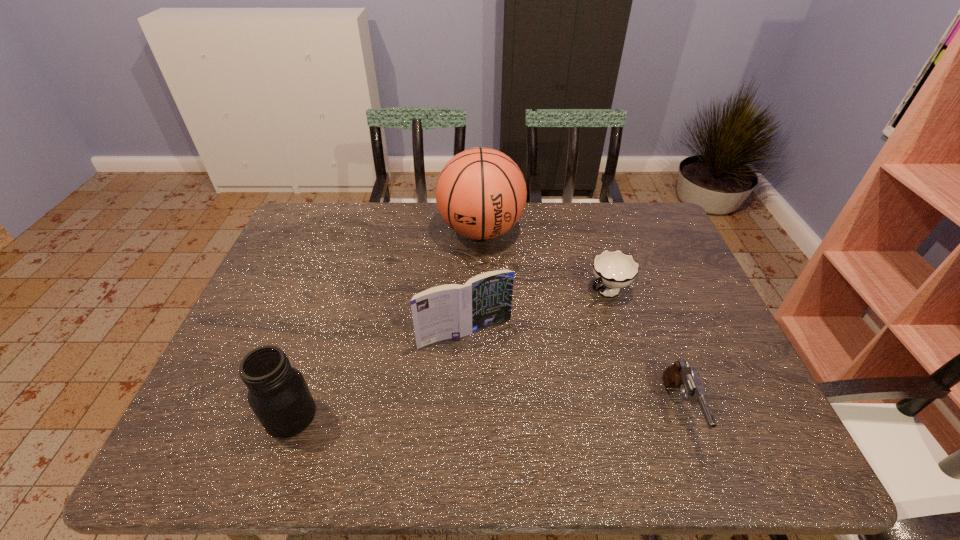
I want to click on object that is at the left edge, so click(x=278, y=394).

Identify the location of object present at the near left corner. pos(278,394).

Where is `vacant space at the far edge of the desktop`? The image size is (960, 540). vacant space at the far edge of the desktop is located at coordinates (516, 237).

Find the location of a particular element. blank area at the near edge is located at coordinates (656, 409).

Identify the location of blank space at the left edge of the desktop. The image size is (960, 540). (307, 256).

In the image, there is a desktop. Where is `free space at the right edge`? The width and height of the screenshot is (960, 540). free space at the right edge is located at coordinates (674, 310).

What are the coordinates of `vacant space at the far left corner` in the screenshot? It's located at (321, 240).

I want to click on vacant space at the far right corner, so click(669, 243).

Identify the location of free space between the fourth tallest object and the second farthest object. This screenshot has height=540, width=960. (643, 350).

In order to click on unoccupied position between the leftmost object and the book in this screenshot , I will do `click(378, 374)`.